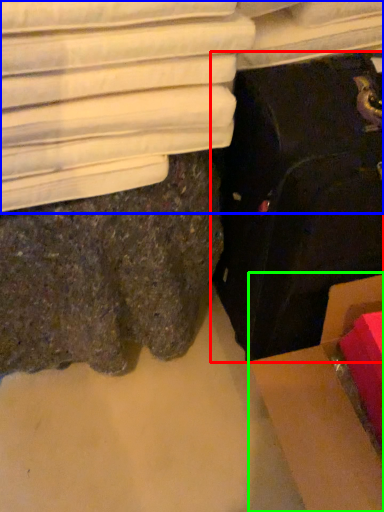
Question: Which object is positioned farthest from suitcase (highlighted by a red box)? Select from furniture (highlighted by a blue box) and cardboard box (highlighted by a green box).

Choices:
 (A) furniture
 (B) cardboard box

Answer: (A)